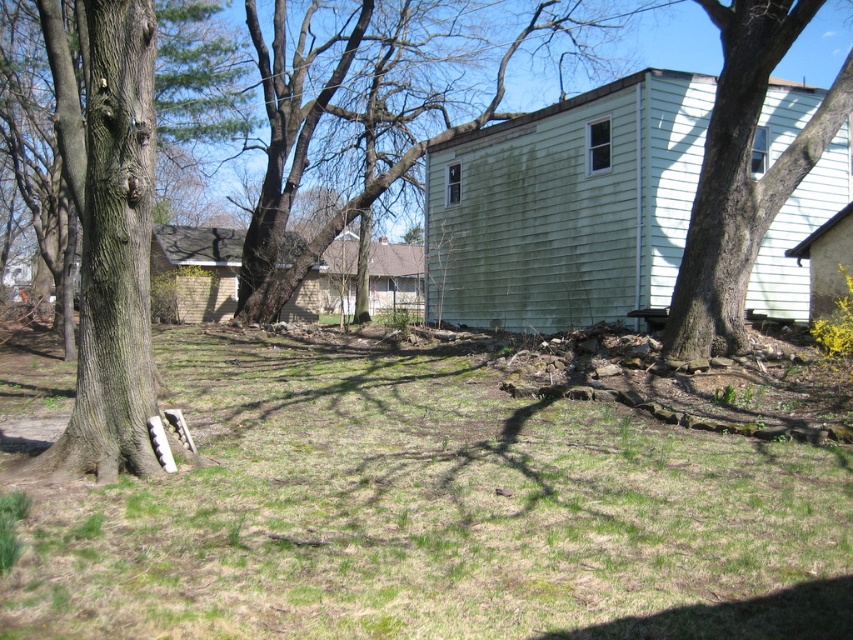
Can you confirm if green grass at center is taller than green painted wood siding at center right?

In fact, green grass at center may be shorter than green painted wood siding at center right.

Can you confirm if green grass at center is shorter than green painted wood siding at center right?

Yes, green grass at center is shorter than green painted wood siding at center right.

Where is `green grass at center`? green grass at center is located at coordinates (433, 513).

Is point (138, 93) farther from camera compared to point (711, 118)?

No, (138, 93) is closer to viewer.

Who is lower down, brown rough bark tree at left or smooth bark tree at right?

brown rough bark tree at left

Does point (36, 1) come behind point (784, 170)?

Yes, point (36, 1) is farther from viewer.

You are a GUI agent. You are given a task and a screenshot of the screen. Output one action in this format:
    pyautogui.click(x=<x>, y=<y>)
    Task: Click on the brown rough bark tree at left
    
    Given the screenshot: What is the action you would take?
    pyautogui.click(x=108, y=230)

The image size is (853, 640). Describe the element at coordinates (433, 513) in the screenshot. I see `green grass at center` at that location.

Is point (482, 476) positioned after point (672, 310)?

No.

The width and height of the screenshot is (853, 640). Identify the location of green grass at center. [433, 513].

You are a GUI agent. You are given a task and a screenshot of the screen. Output one action in this format:
    pyautogui.click(x=<x>, y=<y>)
    Task: Click on the green grass at center
    Image resolution: width=853 pixels, height=640 pixels.
    Given the screenshot: What is the action you would take?
    pyautogui.click(x=433, y=513)